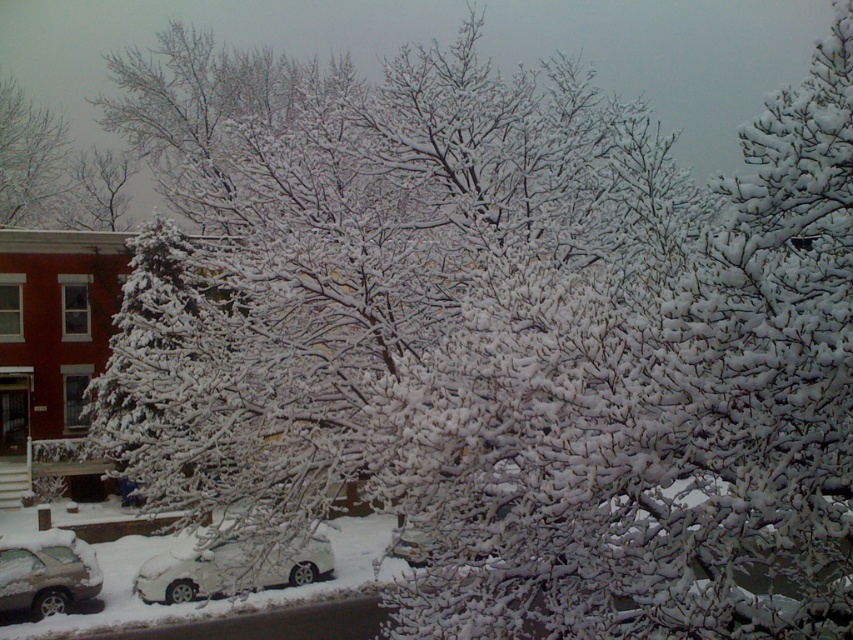
You are a delivery person needing to access both the white matte car at lower left and the silver metallic car at lower left. Since they are parked closely, which car should you approach first to avoid blocking the other?

The white matte car at lower left is located below the silver metallic car at lower left, so you should approach the white matte car at lower left first to avoid blocking the silver metallic car at lower left.